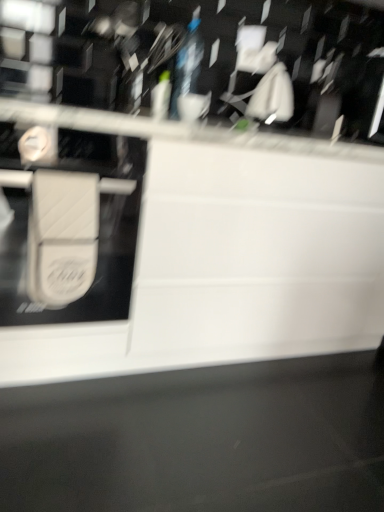
Question: From a real-world perspective, is white matte drawer at center physically below white matte/soft plastic at left?

Choices:
 (A) yes
 (B) no

Answer: (A)

Question: Could you tell me if white matte drawer at center is turned towards white matte/soft plastic at left?

Choices:
 (A) no
 (B) yes

Answer: (B)

Question: Does white matte drawer at center have a smaller size compared to white matte/soft plastic at left?

Choices:
 (A) yes
 (B) no

Answer: (B)

Question: Can white matte/soft plastic at left be found inside white matte drawer at center?

Choices:
 (A) yes
 (B) no

Answer: (B)

Question: Is white matte drawer at center positioned with its back to white matte/soft plastic at left?

Choices:
 (A) yes
 (B) no

Answer: (B)

Question: From the image's perspective, is white matte drawer at center under white matte/soft plastic at left?

Choices:
 (A) no
 (B) yes

Answer: (A)

Question: Does white matte/soft plastic at left have a greater height compared to white matte drawer at center?

Choices:
 (A) no
 (B) yes

Answer: (A)

Question: Can you confirm if white matte/soft plastic at left is positioned to the right of white matte drawer at center?

Choices:
 (A) no
 (B) yes

Answer: (A)

Question: From a real-world perspective, is white matte/soft plastic at left located higher than white matte drawer at center?

Choices:
 (A) no
 (B) yes

Answer: (B)

Question: Can you confirm if white matte/soft plastic at left is shorter than white matte drawer at center?

Choices:
 (A) no
 (B) yes

Answer: (B)

Question: Considering the relative sizes of white matte/soft plastic at left and white matte drawer at center in the image provided, is white matte/soft plastic at left bigger than white matte drawer at center?

Choices:
 (A) yes
 (B) no

Answer: (B)

Question: Does white matte/soft plastic at left have a lesser width compared to white matte drawer at center?

Choices:
 (A) no
 (B) yes

Answer: (B)

Question: Is point (69, 200) closer or farther from the camera than point (354, 293)?

Choices:
 (A) closer
 (B) farther

Answer: (A)